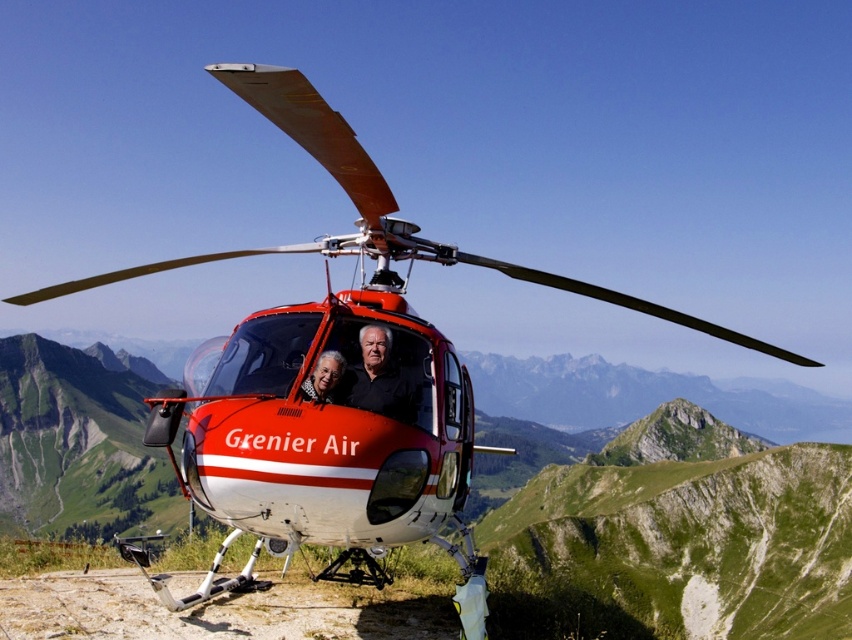
Question: Among these objects, which one is nearest to the camera?

Choices:
 (A) smooth black shirt at center
 (B) black matte shirt at center

Answer: (A)

Question: Observing the image, what is the correct spatial positioning of black matte shirt at center in reference to smooth black shirt at center?

Choices:
 (A) below
 (B) above

Answer: (B)

Question: Can you confirm if black matte shirt at center is bigger than smooth black shirt at center?

Choices:
 (A) yes
 (B) no

Answer: (A)

Question: Which object is closer to the camera taking this photo?

Choices:
 (A) smooth black shirt at center
 (B) black matte shirt at center

Answer: (A)

Question: Is black matte shirt at center further to camera compared to smooth black shirt at center?

Choices:
 (A) no
 (B) yes

Answer: (B)